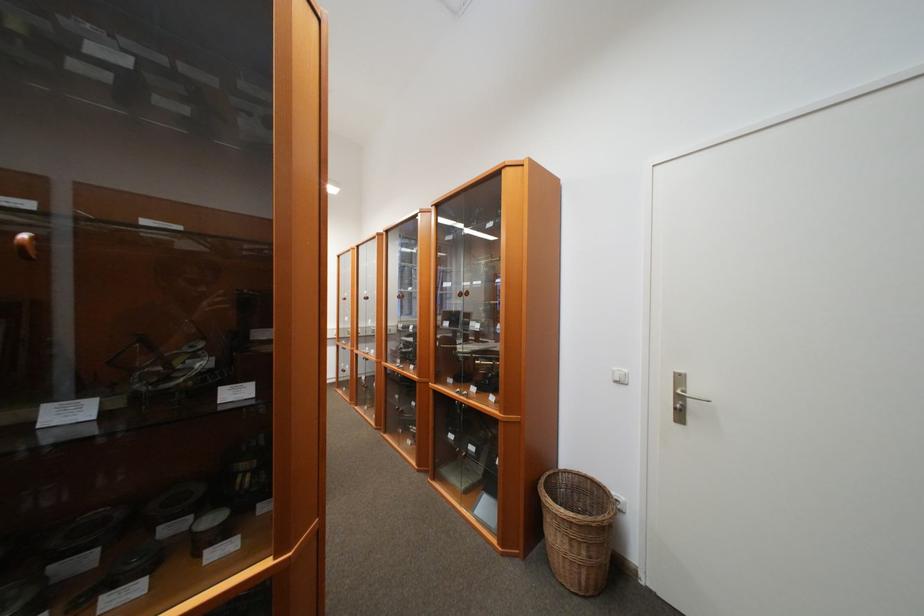
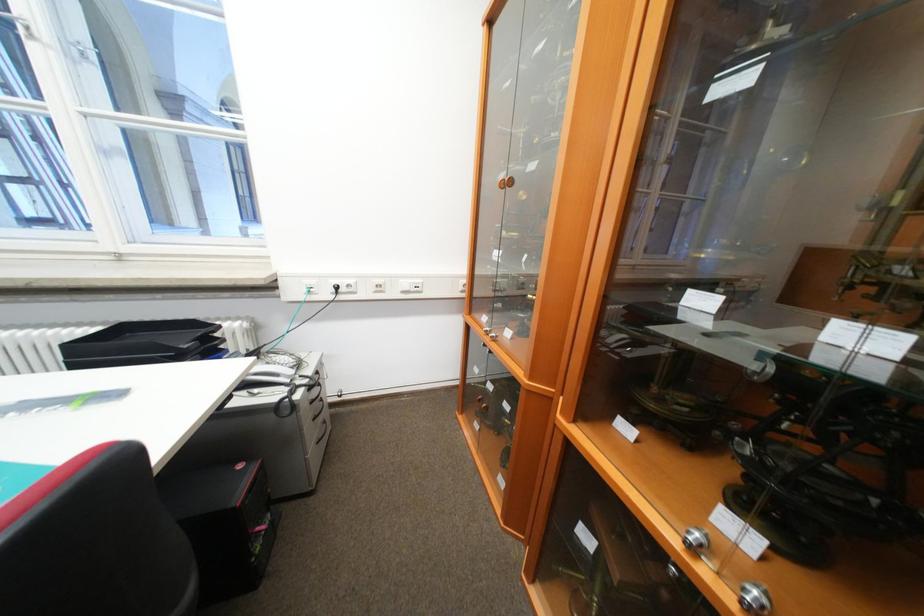
Consider the image. The images are taken continuously from a first-person perspective. In which direction are you moving?

The movement direction of the cameraman is left, forward.